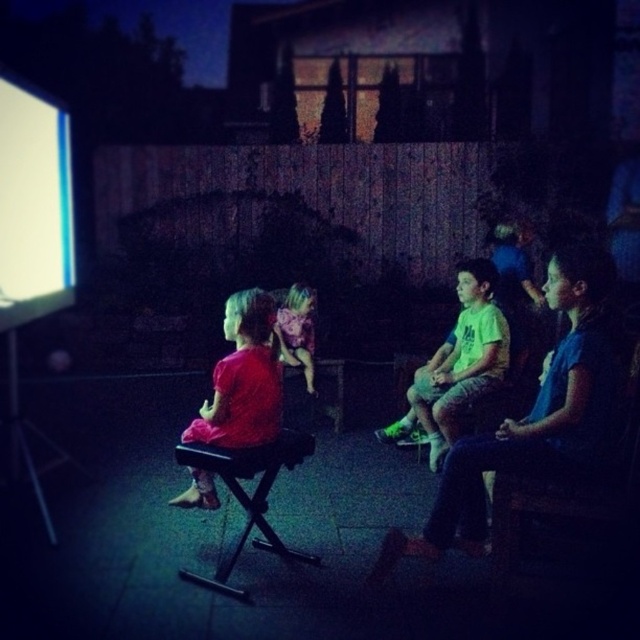
Question: Which point is farther to the camera?

Choices:
 (A) shiny pink wig at center
 (B) matte pink dress at center

Answer: (A)

Question: Does dark blue jeans at right have a greater width compared to shiny pink wig at center?

Choices:
 (A) no
 (B) yes

Answer: (B)

Question: Does dark blue jeans at right appear under matte pink dress at center?

Choices:
 (A) no
 (B) yes

Answer: (B)

Question: Which point is farther to the camera?

Choices:
 (A) (310, 323)
 (B) (493, 464)
 (C) (20, 144)

Answer: (A)

Question: Which point is closer to the camera taking this photo?

Choices:
 (A) (454, 472)
 (B) (64, 128)
 (C) (248, 525)
 (D) (252, 435)

Answer: (A)

Question: Is dark blue jeans at right thinner than matte pink dress at center?

Choices:
 (A) no
 (B) yes

Answer: (A)